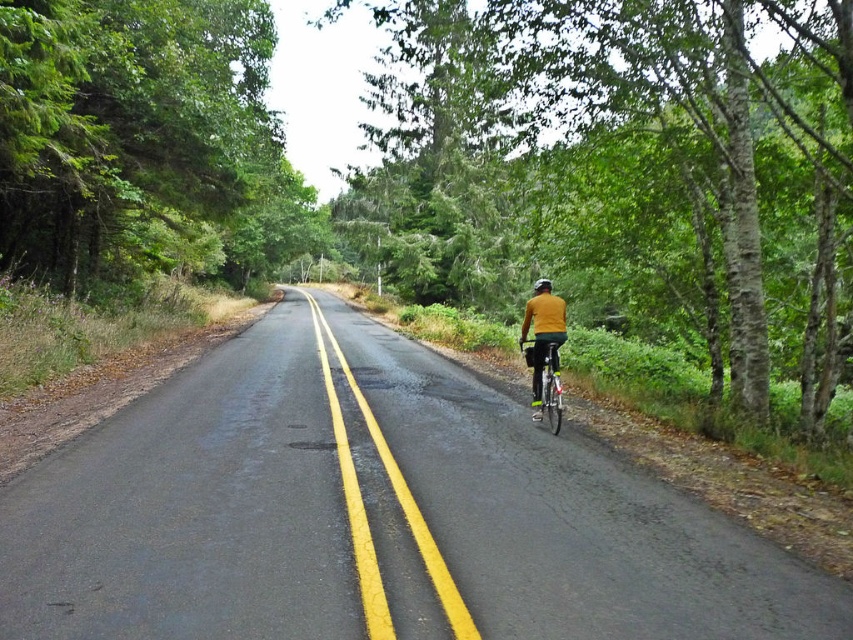
You are a cyclist approaching the green leafy tree at center on a road with a double yellow line. Can you safely pass the cyclist on the right side of the road?

The green leafy tree at center is positioned at point (625, 168), so you cannot safely pass the cyclist on the right side of the road because the double yellow line indicates no passing zones.

You are a cyclist approaching the two points marked on the road. Which point will you reach first, point (167, 173) or point (532, 284)?

Point (167, 173) is in front of point (532, 284), so you will reach point (167, 173) first.

You are a cyclist approaching the two green leafy trees on the road. Which tree would you need to steer around first, the green leafy tree at center or the green leafy tree at left?

The green leafy tree at left is positioned to the left of the road, so you would encounter it first as you approach the road from the starting point. However, based on the description, the green leafy tree at center is wider than the green leafy tree at left, which might require more space when passing. But since the question is about which comes first in your path, the green leafy tree at left would be the first one you need to steer around.